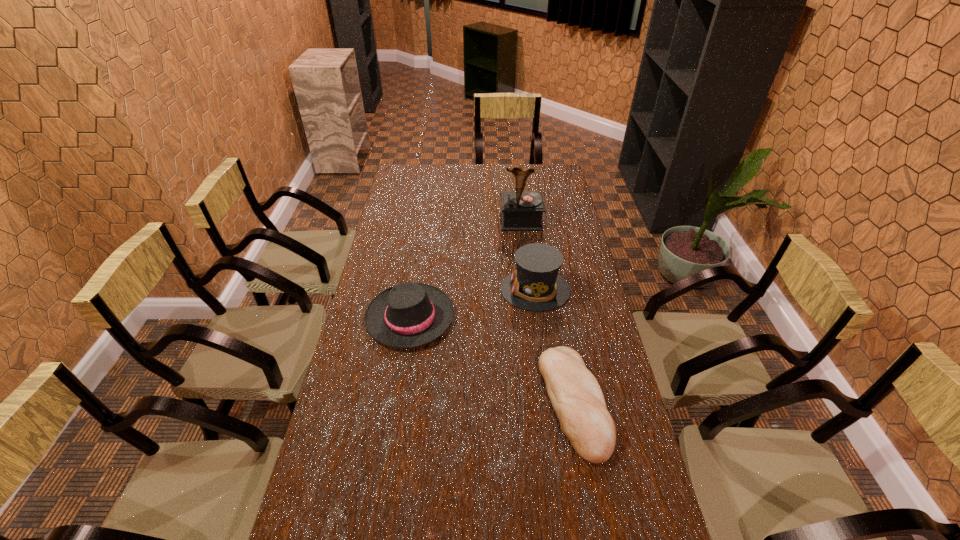
The width and height of the screenshot is (960, 540). In the image, there is a desktop. Identify the location of free region at the far left corner. (414, 171).

This screenshot has height=540, width=960. Find the location of `unoccupied area between the leftmost object and the bread`. unoccupied area between the leftmost object and the bread is located at coordinates (492, 360).

You are a GUI agent. You are given a task and a screenshot of the screen. Output one action in this format:
    pyautogui.click(x=<x>, y=<y>)
    Task: Click on the blank region between the third tallest object and the shortest object
    The image size is (960, 540).
    Given the screenshot: What is the action you would take?
    pyautogui.click(x=492, y=360)

At what (x,y) coordinates should I click in order to perform the action: click on vacant area that lies between the phonograph_record and the shorter dress hat. Please return your answer as a coordinate pair (x, y). The width and height of the screenshot is (960, 540). Looking at the image, I should click on (466, 269).

Locate an element on the screen. vacant space that's between the third tallest object and the shortest object is located at coordinates (492, 360).

The width and height of the screenshot is (960, 540). I want to click on empty location between the shortest object and the second tallest object, so click(555, 346).

Find the location of `vacant area that lies between the second tallest object and the shortest object`. vacant area that lies between the second tallest object and the shortest object is located at coordinates tap(555, 346).

Image resolution: width=960 pixels, height=540 pixels. In order to click on unoccupied position between the bread and the tallest object in this screenshot , I will do coord(547,312).

Find the location of a particular element. Image resolution: width=960 pixels, height=540 pixels. object that is the second closest to the shortest object is located at coordinates (408, 315).

Identify which object is located as the third nearest to the right dress hat. Please provide its 2D coordinates. Your answer should be formatted as a tuple, i.e. [(x, y)], where the tuple contains the x and y coordinates of a point satisfying the conditions above.

[(522, 210)]